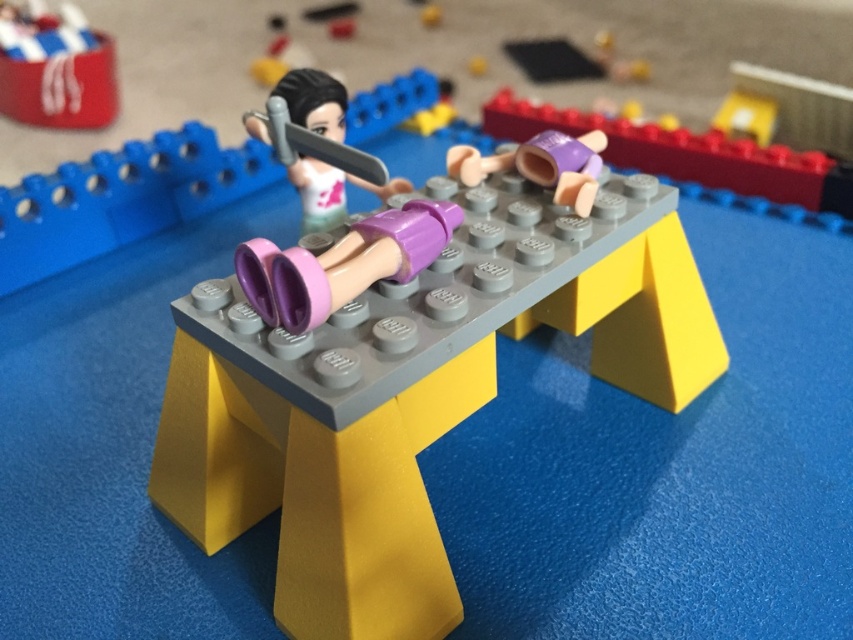
Which is below, purple plastic head at center or matte red can at upper left?

purple plastic head at center is below.

Locate an element on the screen. This screenshot has height=640, width=853. purple plastic head at center is located at coordinates (688, 154).

Who is more distant from viewer, [769,179] or [26,113]?

The point [26,113] is more distant.

At what (x,y) coordinates should I click in order to perform the action: click on purple plastic head at center. Please return your answer as a coordinate pair (x, y). The height and width of the screenshot is (640, 853). Looking at the image, I should click on (688, 154).

Does purple plastic doll at center appear over purple matte/soft plastic legs at center?

Incorrect, purple plastic doll at center is not positioned above purple matte/soft plastic legs at center.

Which is more to the left, purple plastic doll at center or purple matte/soft plastic legs at center?

purple matte/soft plastic legs at center

I want to click on purple plastic doll at center, so click(x=410, y=392).

Is purple matte/soft plastic legs at center wider than matte red can at upper left?

No.

Does purple matte/soft plastic legs at center have a larger size compared to matte red can at upper left?

No, purple matte/soft plastic legs at center is not bigger than matte red can at upper left.

Who is more forward, (x=349, y=284) or (x=1, y=26)?

Positioned in front is point (x=349, y=284).

Where is `purple matte/soft plastic legs at center`? This screenshot has width=853, height=640. purple matte/soft plastic legs at center is located at coordinates (341, 262).